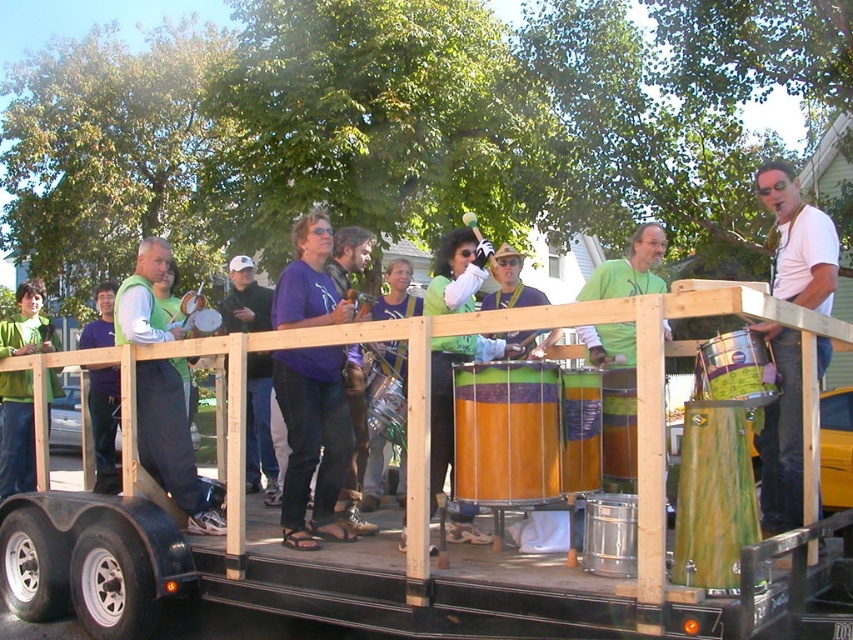
Question: Is green matte jacket at left below green matte drum at center?

Choices:
 (A) no
 (B) yes

Answer: (B)

Question: Is white matte shirt at upper right to the right of green matte vest at left from the viewer's perspective?

Choices:
 (A) no
 (B) yes

Answer: (B)

Question: Among these points, which one is farthest from the camera?

Choices:
 (A) (613, 292)
 (B) (35, 349)
 (C) (792, 445)

Answer: (B)

Question: Among these points, which one is nearest to the camera?

Choices:
 (A) (793, 358)
 (B) (181, 428)
 (C) (16, 291)
 (D) (585, 336)

Answer: (A)

Question: Estimate the real-world distances between objects in this image. Which object is closer to the purple matte shirt at center?

Choices:
 (A) green matte jacket at left
 (B) green matte drum at center
 (C) green matte vest at left

Answer: (A)

Question: Does purple matte shirt at center appear under green matte drum at center?

Choices:
 (A) no
 (B) yes

Answer: (B)